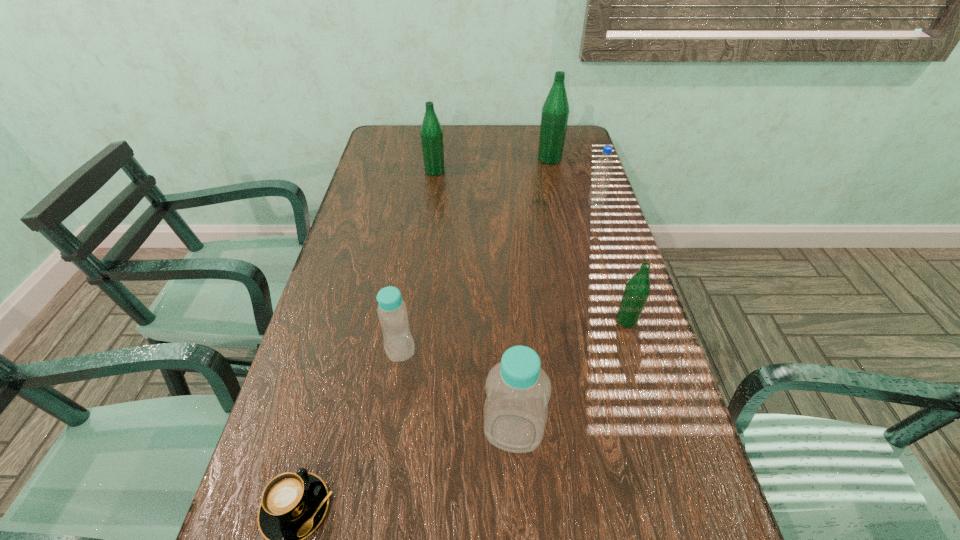
Locate an element on the screen. Image resolution: width=960 pixels, height=540 pixels. vacant space situated 0.350m on the front of the fourth bottle from left to right is located at coordinates (564, 228).

Identify the location of free region located 0.220m on the back of the second smallest green bottle. (440, 136).

Where is `free region located on the left of the third bottle from right to left`? The image size is (960, 540). free region located on the left of the third bottle from right to left is located at coordinates (298, 432).

At what (x,y) coordinates should I click in order to perform the action: click on vacant space located 0.280m on the front of the fifth nearest object. Please return your answer as a coordinate pair (x, y). This screenshot has width=960, height=540. Looking at the image, I should click on (617, 273).

The height and width of the screenshot is (540, 960). What are the coordinates of `free space located 0.370m on the right of the smaller blue bottle` in the screenshot? It's located at (580, 348).

The image size is (960, 540). I want to click on free space located 0.050m on the front of the fourth nearest object, so click(x=635, y=347).

Image resolution: width=960 pixels, height=540 pixels. In order to click on object positioned at the far edge in this screenshot , I will do 555,112.

I want to click on water bottle located in the right edge section of the desktop, so click(597, 195).

The height and width of the screenshot is (540, 960). What are the coordinates of `object that is at the far right corner` in the screenshot? It's located at (555, 112).

In the image, there is a desktop. Where is `vacant space at the far edge`? This screenshot has height=540, width=960. vacant space at the far edge is located at coordinates (497, 133).